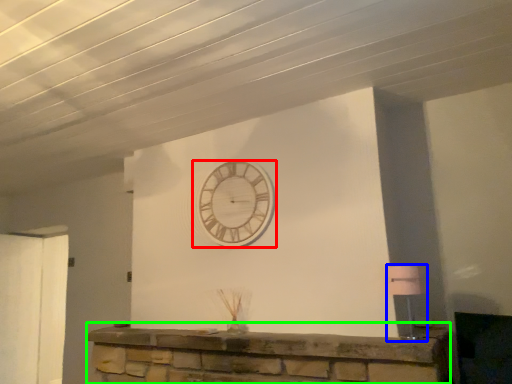
Question: Which object is the closest to the wall clock (highlighted by a red box)? Choose among these: lamp (highlighted by a blue box) or furniture (highlighted by a green box).

Choices:
 (A) lamp
 (B) furniture

Answer: (B)